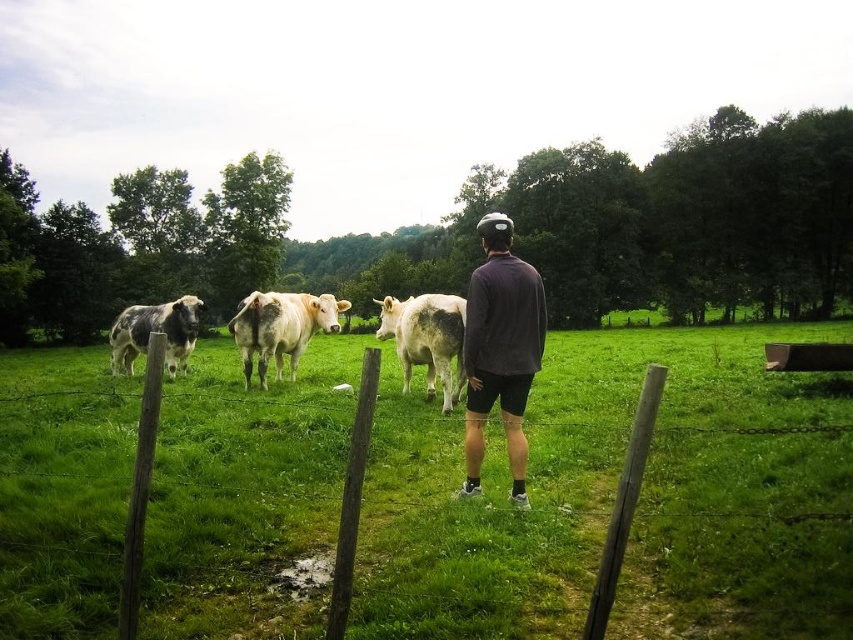
Question: Which object appears farthest from the camera in this image?

Choices:
 (A) speckled fur bull at left
 (B) dark gray jersey at center
 (C) white smooth cow at center

Answer: (A)

Question: Is green grassy field at center wider than white smooth cow at center?

Choices:
 (A) no
 (B) yes

Answer: (B)

Question: Can you confirm if white matte cow at center is positioned to the left of speckled fur bull at left?

Choices:
 (A) no
 (B) yes

Answer: (A)

Question: Which point is closer to the camera taking this photo?

Choices:
 (A) (140, 307)
 (B) (242, 346)

Answer: (B)

Question: Which of the following is the closest to the observer?

Choices:
 (A) dark gray jersey at center
 (B) green grassy field at center
 (C) white matte cow at center

Answer: (B)

Question: Does green grassy field at center appear on the left side of white matte cow at center?

Choices:
 (A) no
 (B) yes

Answer: (B)